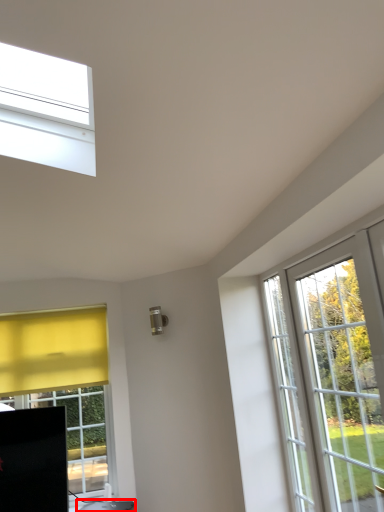
Question: In this image, where is furniture (annotated by the red box) located relative to screen door?

Choices:
 (A) right
 (B) left

Answer: (B)